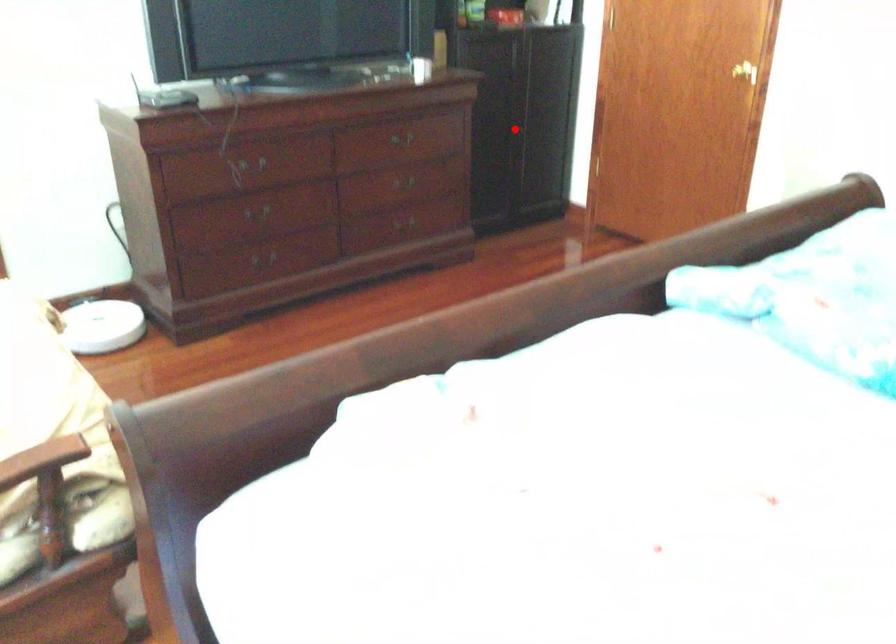
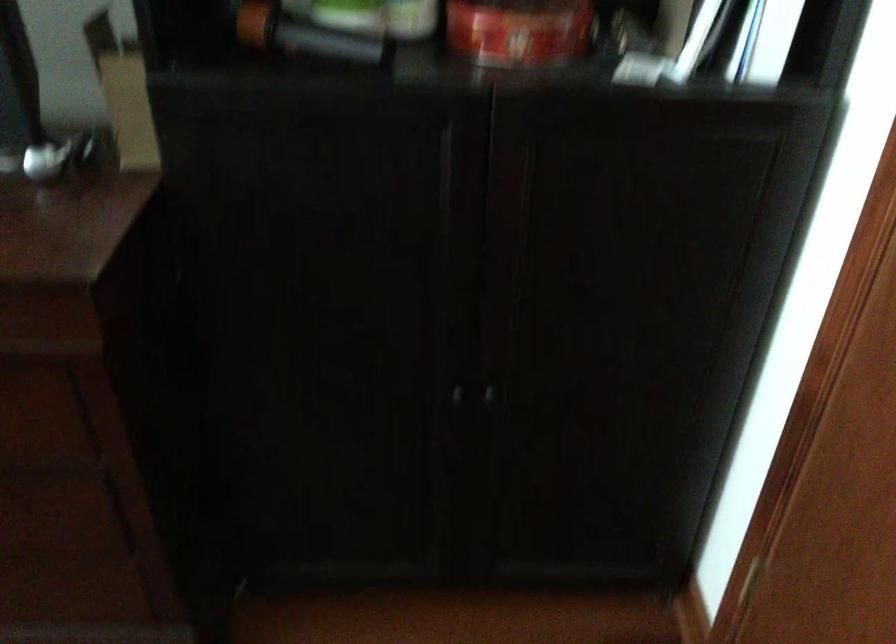
Question: I am providing you with two images of the same scene from different viewpoints. Given a red point in image1, look at the same physical point in image2. Is it:

Choices:
 (A) Closer to the viewpoint
 (B) Farther from the viewpoint

Answer: (A)